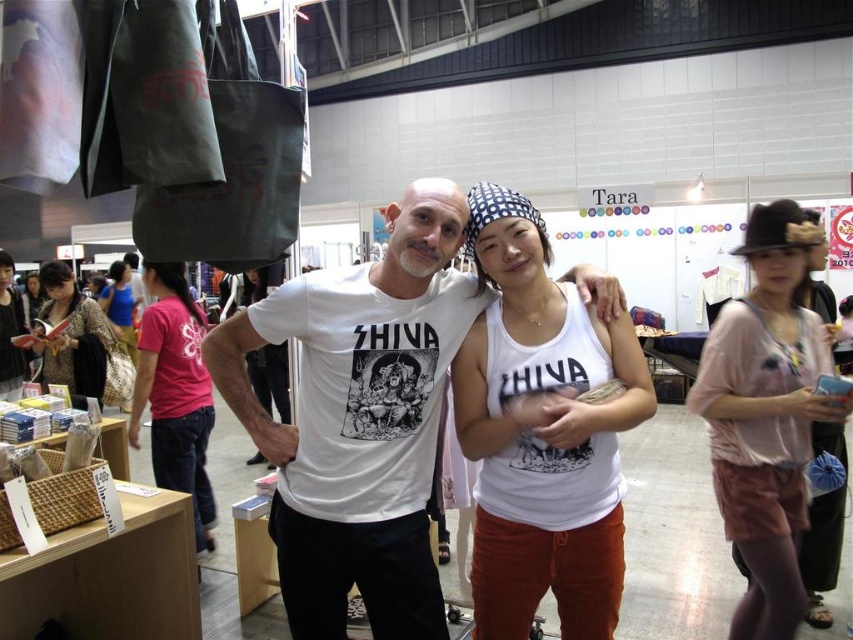
You are a photographer at the market and want to capture a photo of the matte black shirt at left and the blue cotton tank top at center. Which of the two shirts is covering part of the other?

The matte black shirt at left is positioned over the blue cotton tank top at center, so it is covering part of it.

You are a photographer standing at the front of the market and want to focus your camera on either the point at (27, 376) or the point at (134, 307). Which point should you focus on first to ensure it appears sharp in the photo?

You should focus on the point at (27, 376) first because it is closer to the camera than the point at (134, 307).